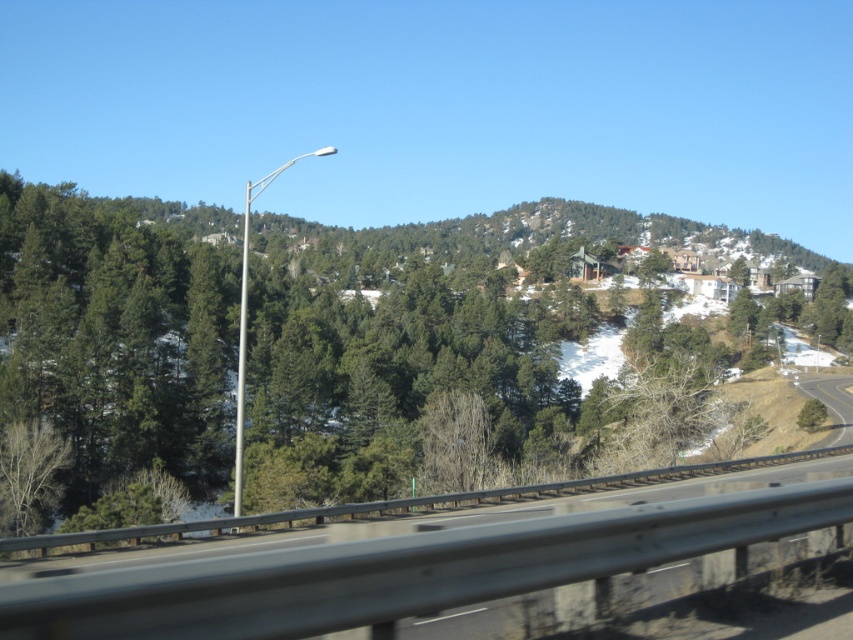
Question: Can you confirm if silver metallic street light at center-left is bigger than metallic pole at center?

Choices:
 (A) yes
 (B) no

Answer: (A)

Question: Which point appears closest to the camera in this image?

Choices:
 (A) (461, 600)
 (B) (42, 241)
 (C) (239, 476)
 (D) (242, 339)

Answer: (A)

Question: Can you confirm if green evergreen tree at center is positioned to the right of metallic pole at center?

Choices:
 (A) yes
 (B) no

Answer: (A)

Question: Which point is farther from the camera taking this photo?

Choices:
 (A) (245, 250)
 (B) (247, 276)

Answer: (B)

Question: Estimate the real-world distances between objects in this image. Which object is farther from the metallic gray highway at center?

Choices:
 (A) silver metallic street light at center-left
 (B) green evergreen tree at center
 (C) metallic pole at center

Answer: (A)

Question: Does green evergreen tree at center have a lesser width compared to metallic pole at center?

Choices:
 (A) no
 (B) yes

Answer: (A)